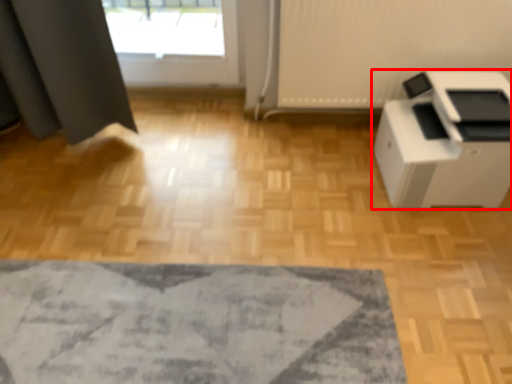
Question: From the image's perspective, considering the relative positions of home appliance (annotated by the red box) and mat in the image provided, where is home appliance (annotated by the red box) located with respect to the staircase?

Choices:
 (A) above
 (B) below

Answer: (A)